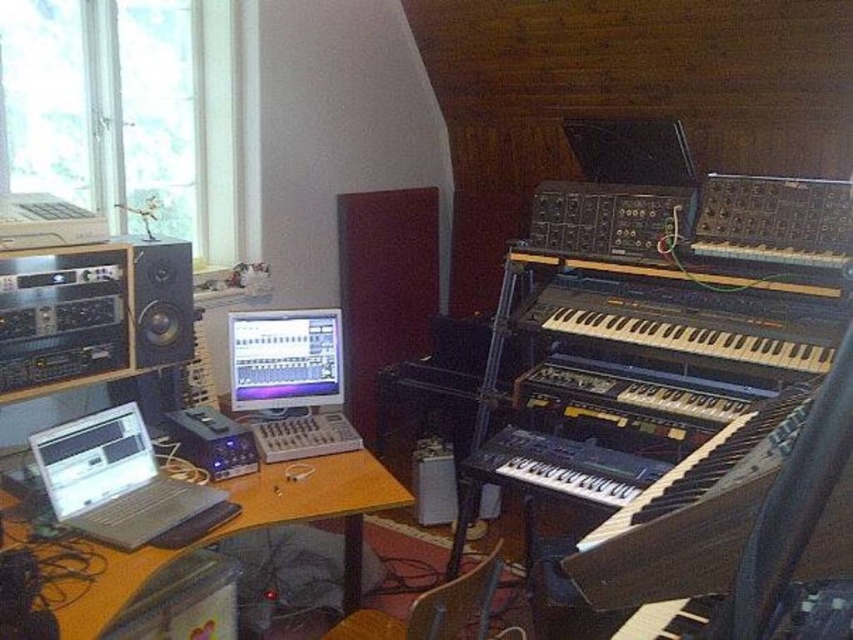
Can you confirm if black plastic keyboard at center-right is positioned to the right of matte black monitor at center?

Yes, black plastic keyboard at center-right is to the right of matte black monitor at center.

Looking at this image, who is more forward, (x=747, y=355) or (x=273, y=316)?

Point (x=747, y=355)

Locate an element on the screen. black plastic keyboard at center-right is located at coordinates (692, 323).

Is silver metallic laptop at lower left thinner than matte black speaker at left?

Incorrect, silver metallic laptop at lower left's width is not less than matte black speaker at left's.

Is silver metallic laptop at lower left to the right of matte black speaker at left from the viewer's perspective?

Indeed, silver metallic laptop at lower left is positioned on the right side of matte black speaker at left.

This screenshot has width=853, height=640. In order to click on silver metallic laptop at lower left in this screenshot , I will do `click(120, 483)`.

Is black plastic keyboard at center-right further to the viewer compared to matte black speaker at left?

No, it is not.

Between black plastic keyboard at center-right and matte black speaker at left, which one is positioned lower?

black plastic keyboard at center-right

Is point (659, 333) positioned in front of point (154, 314)?

No, (659, 333) is behind (154, 314).

Where is `black plastic keyboard at center-right`? The height and width of the screenshot is (640, 853). black plastic keyboard at center-right is located at coordinates (692, 323).